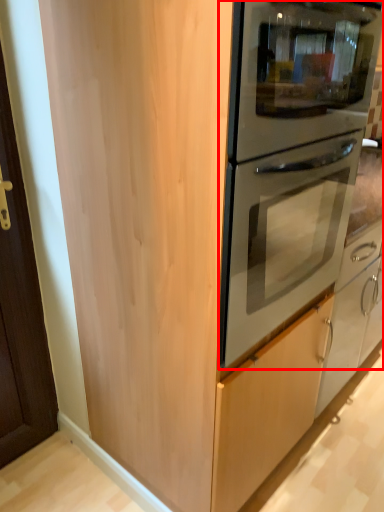
Question: Observing the image, what is the correct spatial positioning of oven (annotated by the red box) in reference to door handle?

Choices:
 (A) left
 (B) right

Answer: (A)